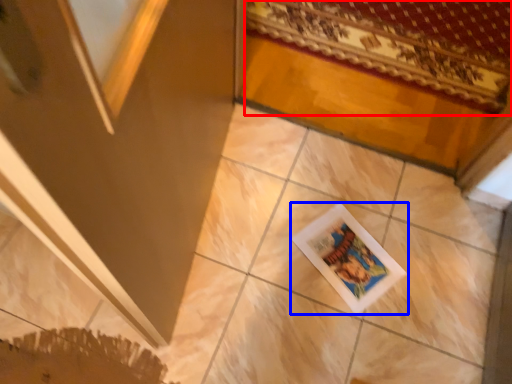
Question: Which point is closer to the camera, mat (highlighted by a red box) or picture frame (highlighted by a blue box)?

Choices:
 (A) mat
 (B) picture frame

Answer: (B)